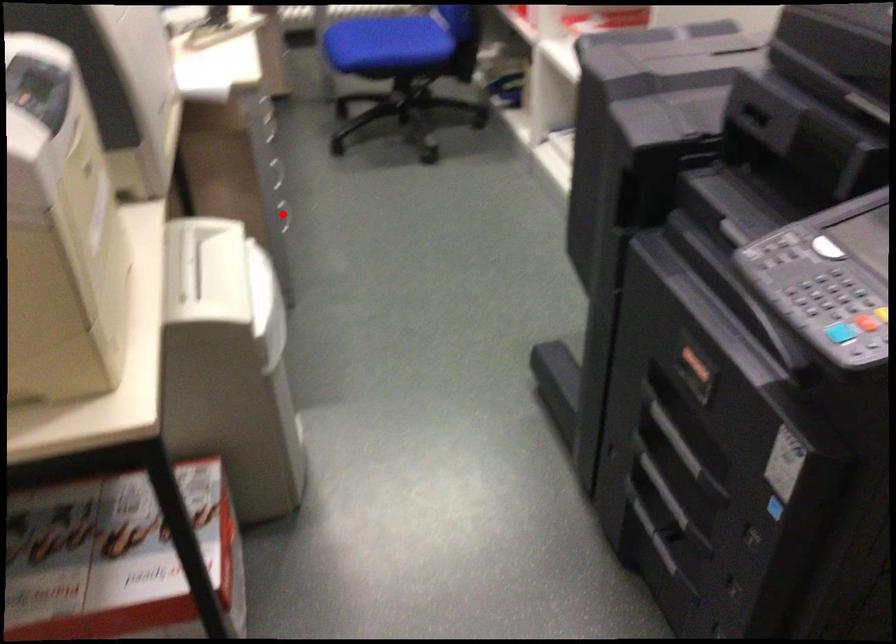
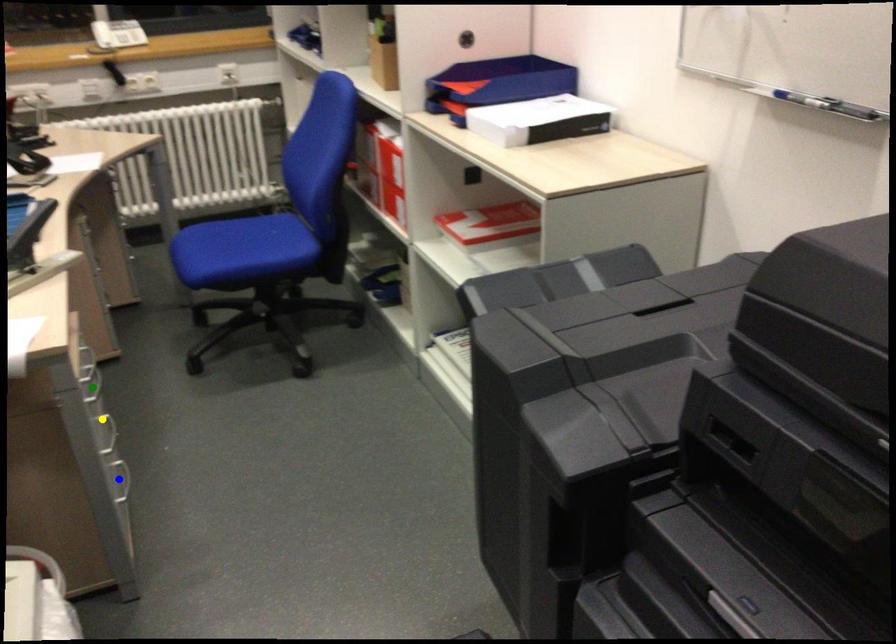
Question: I am providing you with two images of the same scene from different viewpoints. A red point is marked on the first image. You are given multiple points on the second image. Which point in image 2 is actually the same real-world point as the red point in image 1?

Choices:
 (A) yellow point
 (B) green point
 (C) blue point

Answer: (C)